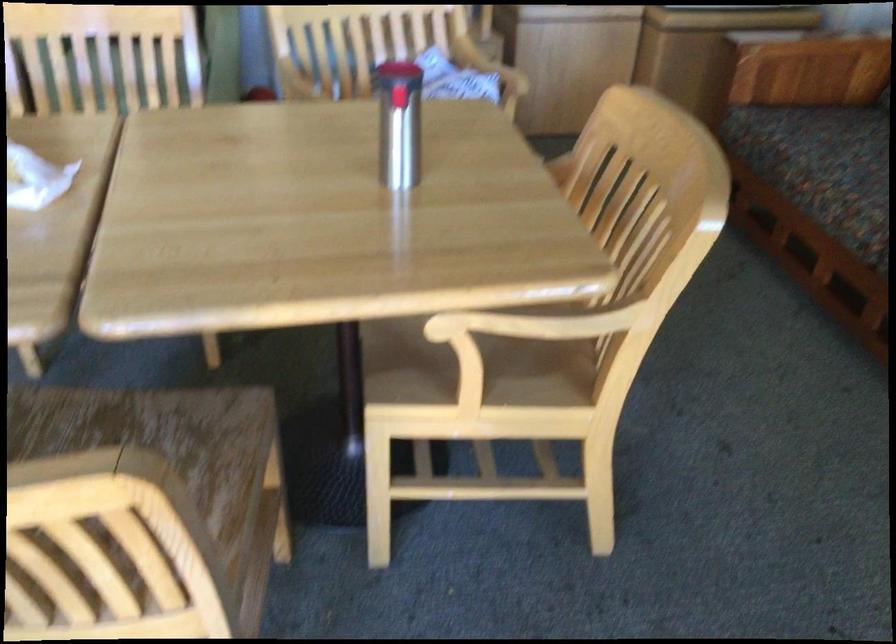
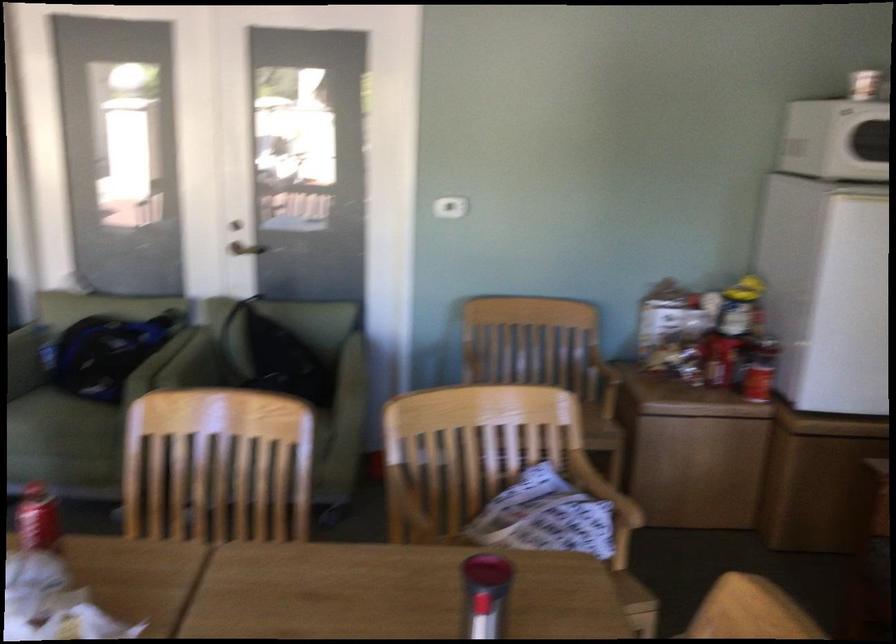
Find the pixel in the second image that matches point (100, 76) in the first image.

(217, 466)